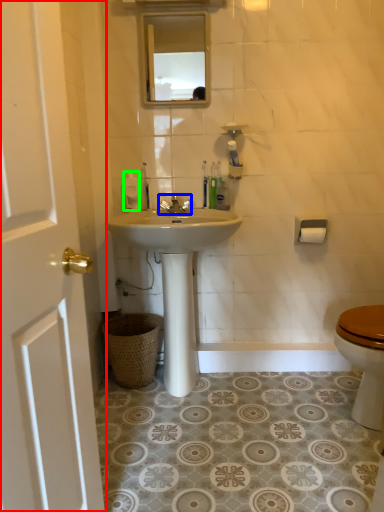
Question: Estimate the real-world distances between objects in this image. Which object is closer to door (highlighted by a red box), faucet (highlighted by a blue box) or toiletries (highlighted by a green box)?

Choices:
 (A) faucet
 (B) toiletries

Answer: (B)